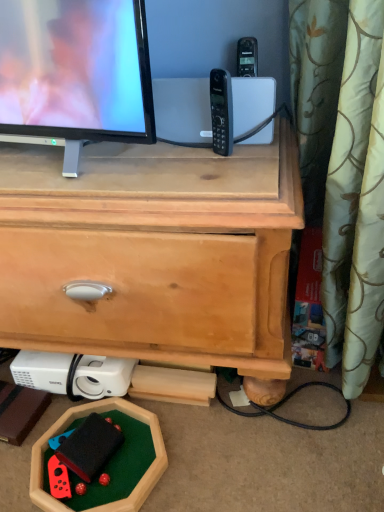
This screenshot has width=384, height=512. What are the coordinates of `vacant space in front of black plastic phone at center` in the screenshot? It's located at (217, 180).